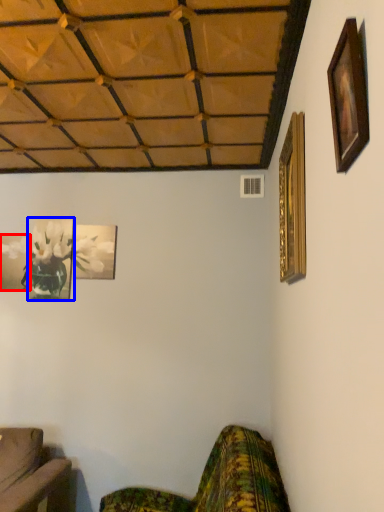
Question: Which object appears closest to the camera in this image, picture frame (highlighted by a red box) or picture frame (highlighted by a blue box)?

Choices:
 (A) picture frame
 (B) picture frame

Answer: (B)